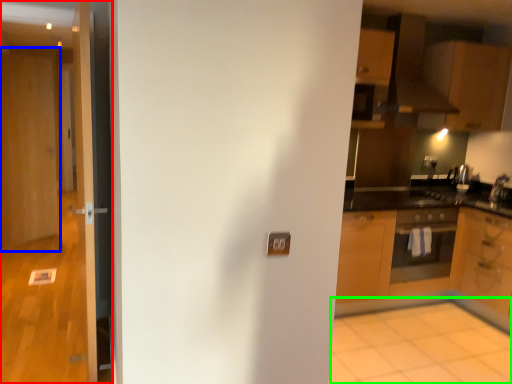
Question: Which is nearer to the door (highlighted by a red box)? door (highlighted by a blue box) or plain (highlighted by a green box).

Choices:
 (A) door
 (B) plain

Answer: (B)